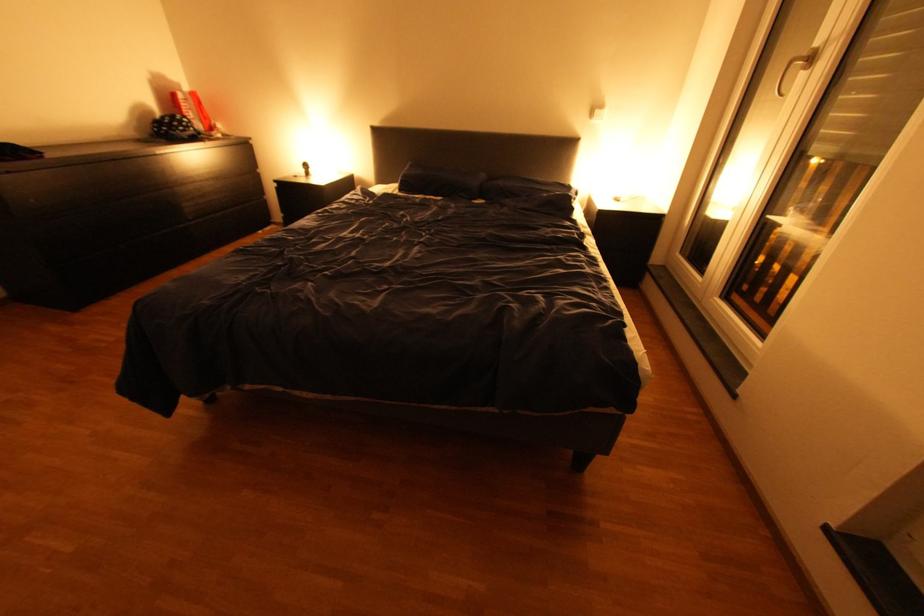
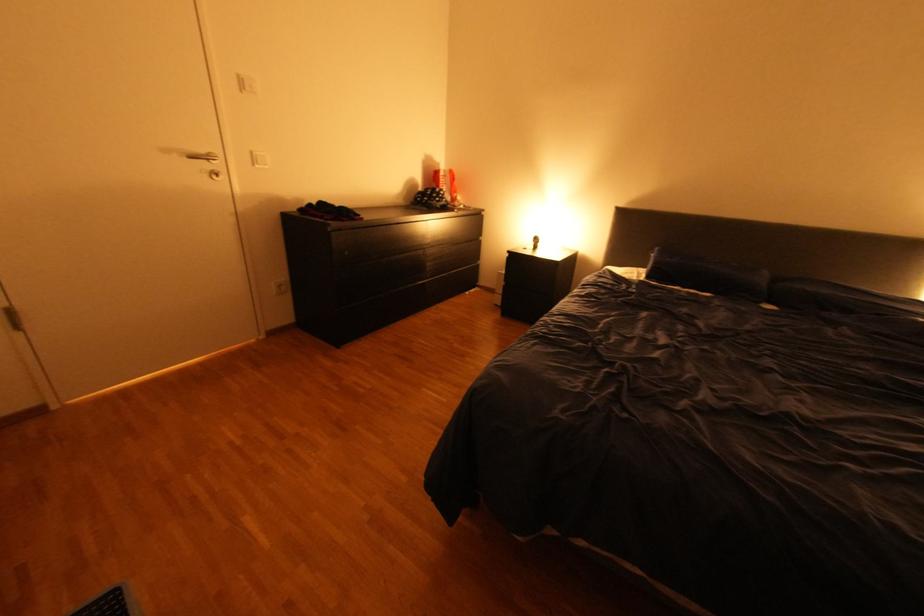
Question: The first image is from the beginning of the video and the second image is from the end. How did the camera likely rotate when shooting the video?

Choices:
 (A) Left
 (B) Right
 (C) Up
 (D) Down

Answer: (A)